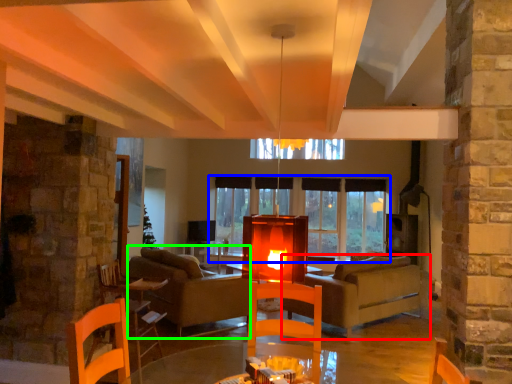
Question: Based on their relative distances, which object is farther from studio couch (highlighted by a red box)? Choose from window (highlighted by a blue box) and couch (highlighted by a green box).

Choices:
 (A) window
 (B) couch

Answer: (B)